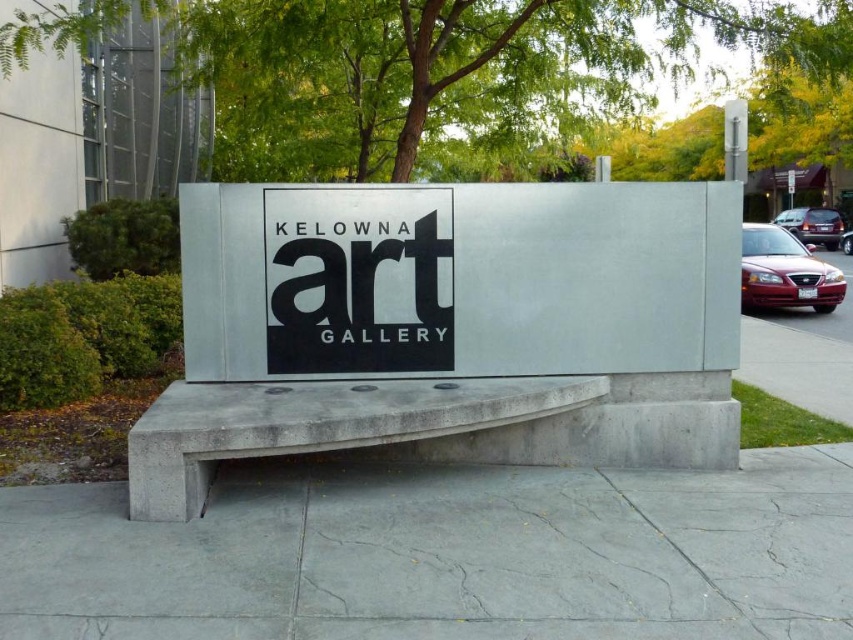
Question: Which object is positioned farthest from the matte red car at right?

Choices:
 (A) gray concrete bench at center
 (B) white concrete sign at center

Answer: (A)

Question: Is white concrete sign at center positioned before gray concrete bench at center?

Choices:
 (A) yes
 (B) no

Answer: (B)

Question: Is gray concrete bench at center in front of matte red car at right?

Choices:
 (A) yes
 (B) no

Answer: (A)

Question: Is gray concrete bench at center above matte red car at right?

Choices:
 (A) yes
 (B) no

Answer: (B)

Question: Which is nearer to the matte red car at right?

Choices:
 (A) white concrete sign at center
 (B) gray concrete bench at center

Answer: (A)

Question: Which of the following is the closest to the observer?

Choices:
 (A) gray concrete bench at center
 (B) white concrete sign at center

Answer: (A)